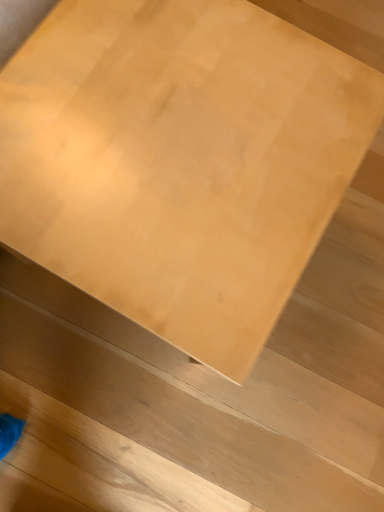
Image resolution: width=384 pixels, height=512 pixels. Identify the location of light wood/stained stair at center. (202, 394).

Describe the element at coordinates (202, 394) in the screenshot. I see `light wood/stained stair at center` at that location.

Identify the location of light wood/stained stair at center. The width and height of the screenshot is (384, 512). (202, 394).